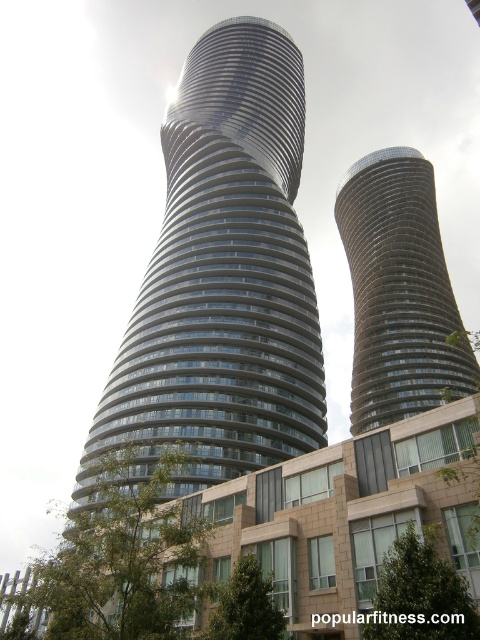
Does point (145, 332) come in front of point (372, 260)?

Yes, point (145, 332) is closer to viewer.

Who is positioned more to the left, glassy steel tower at center or glassy metallic tower at center?

From the viewer's perspective, glassy steel tower at center appears more on the left side.

At what (x,y) coordinates should I click in order to perform the action: click on glassy steel tower at center. Please return your answer as a coordinate pair (x, y). Looking at the image, I should click on (219, 284).

Locate an element on the screen. The image size is (480, 640). glassy steel tower at center is located at coordinates (219, 284).